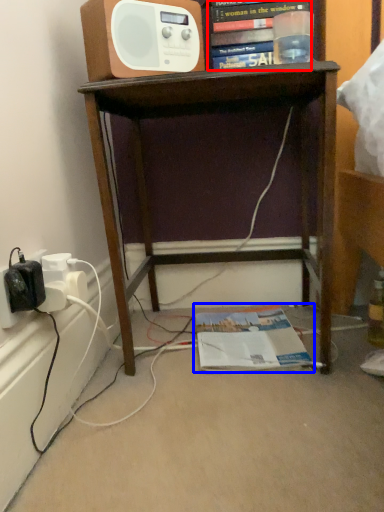
Question: Which object is closer to the camera taking this photo, book (highlighted by a red box) or magazine (highlighted by a blue box)?

Choices:
 (A) book
 (B) magazine

Answer: (A)